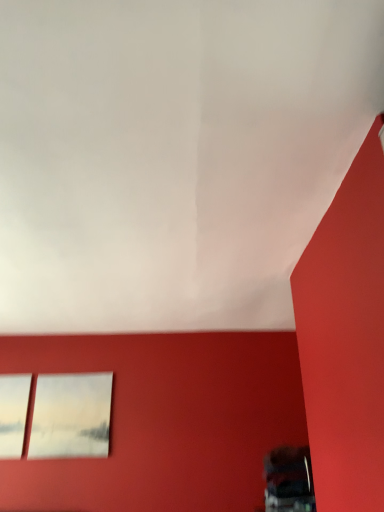
Describe the element at coordinates (71, 416) in the screenshot. I see `matte white picture frame at upper left` at that location.

Find the location of a particular element. matte white picture frame at upper left is located at coordinates (71, 416).

In order to face transparent glass window at lower left, should I rotate leftwards or rightwards?

A 23.353 degree turn to the left will do.

The width and height of the screenshot is (384, 512). What do you see at coordinates (13, 413) in the screenshot? I see `transparent glass window at lower left` at bounding box center [13, 413].

Find the location of a particular element. The image size is (384, 512). transparent glass window at lower left is located at coordinates (x=13, y=413).

I want to click on matte white picture frame at upper left, so click(71, 416).

Would you say transparent glass window at lower left is to the left or to the right of matte white picture frame at upper left in the picture?

In the image, transparent glass window at lower left appears on the left side of matte white picture frame at upper left.

Is transparent glass window at lower left positioned before matte white picture frame at upper left?

Result: Yes, it is in front of matte white picture frame at upper left.

Between point (12, 417) and point (112, 376), which one is positioned in front?

The point (12, 417) is more forward.

From the image's perspective, which object appears higher, transparent glass window at lower left or matte white picture frame at upper left?

transparent glass window at lower left.

From a real-world perspective, which object stands above the other?

From a 3D spatial view, transparent glass window at lower left is above.

Considering the relative sizes of transparent glass window at lower left and matte white picture frame at upper left in the image provided, is transparent glass window at lower left thinner than matte white picture frame at upper left?

Incorrect, the width of transparent glass window at lower left is not less than that of matte white picture frame at upper left.

Considering the sizes of objects transparent glass window at lower left and matte white picture frame at upper left in the image provided, who is taller, transparent glass window at lower left or matte white picture frame at upper left?

matte white picture frame at upper left.

Considering the sizes of objects transparent glass window at lower left and matte white picture frame at upper left in the image provided, who is smaller, transparent glass window at lower left or matte white picture frame at upper left?

transparent glass window at lower left.

Based on the photo, can matte white picture frame at upper left be found inside transparent glass window at lower left?

Actually, matte white picture frame at upper left is outside transparent glass window at lower left.

Is transparent glass window at lower left beside matte white picture frame at upper left?

No, transparent glass window at lower left is not beside matte white picture frame at upper left.

Is transparent glass window at lower left oriented away from matte white picture frame at upper left?

No, transparent glass window at lower left is not facing the opposite direction of matte white picture frame at upper left.

What's the angular difference between transparent glass window at lower left and matte white picture frame at upper left's facing directions?

0.0093 degrees.

Could you measure the distance between transparent glass window at lower left and matte white picture frame at upper left?

transparent glass window at lower left and matte white picture frame at upper left are 11.13 inches apart from each other.

The height and width of the screenshot is (512, 384). In order to click on picture frame below the transparent glass window at lower left (from the image's perspective) in this screenshot , I will do `click(71, 416)`.

Which is more to the right, matte white picture frame at upper left or transparent glass window at lower left?

Positioned to the right is matte white picture frame at upper left.

Which is in front, matte white picture frame at upper left or transparent glass window at lower left?

Positioned in front is transparent glass window at lower left.

Does point (100, 411) come in front of point (29, 383)?

Yes, point (100, 411) is in front of point (29, 383).

In the scene shown: From the image's perspective, is matte white picture frame at upper left positioned above or below transparent glass window at lower left?

matte white picture frame at upper left is situated lower than transparent glass window at lower left in the image.

From a real-world perspective, which object rests below the other?

matte white picture frame at upper left.

Looking at their sizes, would you say matte white picture frame at upper left is wider or thinner than transparent glass window at lower left?

Clearly, matte white picture frame at upper left has less width compared to transparent glass window at lower left.

Who is taller, matte white picture frame at upper left or transparent glass window at lower left?

With more height is matte white picture frame at upper left.

Considering the relative sizes of matte white picture frame at upper left and transparent glass window at lower left in the image provided, is matte white picture frame at upper left smaller than transparent glass window at lower left?

No, matte white picture frame at upper left is not smaller than transparent glass window at lower left.

Is matte white picture frame at upper left surrounding transparent glass window at lower left?

No, transparent glass window at lower left is not a part of matte white picture frame at upper left.

Would you say matte white picture frame at upper left is a long distance from transparent glass window at lower left?

No, matte white picture frame at upper left is in close proximity to transparent glass window at lower left.

Looking at this image, does matte white picture frame at upper left turn towards transparent glass window at lower left?

No, matte white picture frame at upper left is not aimed at transparent glass window at lower left.

This screenshot has width=384, height=512. Find the location of `window above the matte white picture frame at upper left (from the image's perspective)`. window above the matte white picture frame at upper left (from the image's perspective) is located at coordinates (13, 413).

Identify the location of picture frame below the transparent glass window at lower left (from the image's perspective). (71, 416).

Locate an element on the screen. This screenshot has height=512, width=384. picture frame that appears on the right of transparent glass window at lower left is located at coordinates (71, 416).